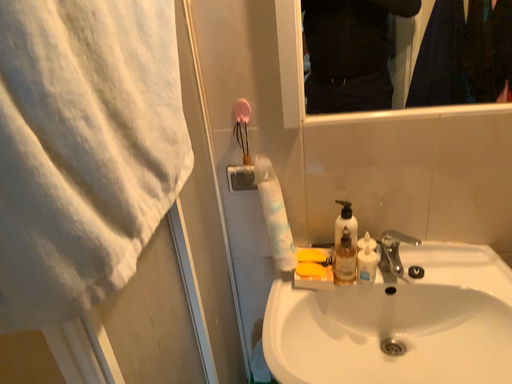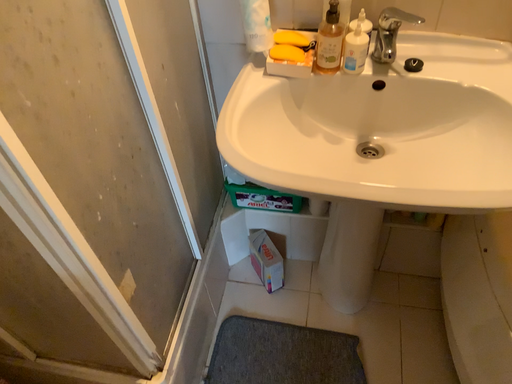
Question: Which way did the camera rotate in the video?

Choices:
 (A) rotated upward
 (B) rotated downward

Answer: (B)